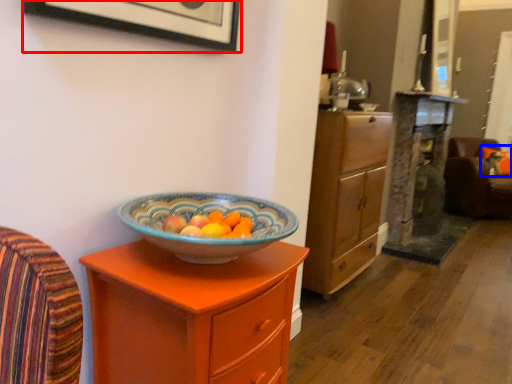
Question: Which point is further to the camera, picture frame (highlighted by a red box) or pillow (highlighted by a blue box)?

Choices:
 (A) picture frame
 (B) pillow

Answer: (B)